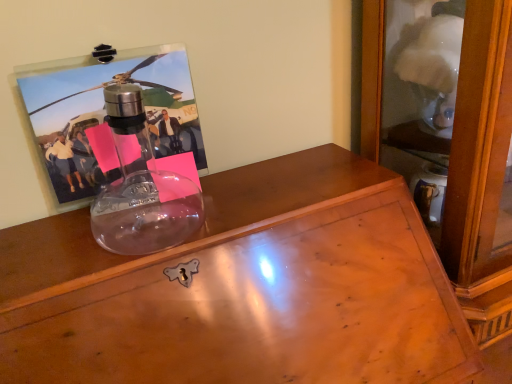
Question: From the image's perspective, relative to transparent glass desk at upper left, is clear plastic frame at upper left above or below?

Choices:
 (A) above
 (B) below

Answer: (A)

Question: Looking at the image, does clear plastic frame at upper left seem bigger or smaller compared to transparent glass desk at upper left?

Choices:
 (A) small
 (B) big

Answer: (A)

Question: In the image, is clear plastic frame at upper left on the left side or the right side of transparent glass desk at upper left?

Choices:
 (A) left
 (B) right

Answer: (A)

Question: Based on their sizes in the image, would you say transparent glass desk at upper left is bigger or smaller than clear plastic frame at upper left?

Choices:
 (A) small
 (B) big

Answer: (B)

Question: From the image's perspective, relative to clear plastic frame at upper left, is transparent glass desk at upper left above or below?

Choices:
 (A) below
 (B) above

Answer: (A)

Question: Is transparent glass desk at upper left in front of or behind clear plastic frame at upper left in the image?

Choices:
 (A) behind
 (B) front

Answer: (B)

Question: Is point (343, 324) closer or farther from the camera than point (170, 127)?

Choices:
 (A) farther
 (B) closer

Answer: (B)